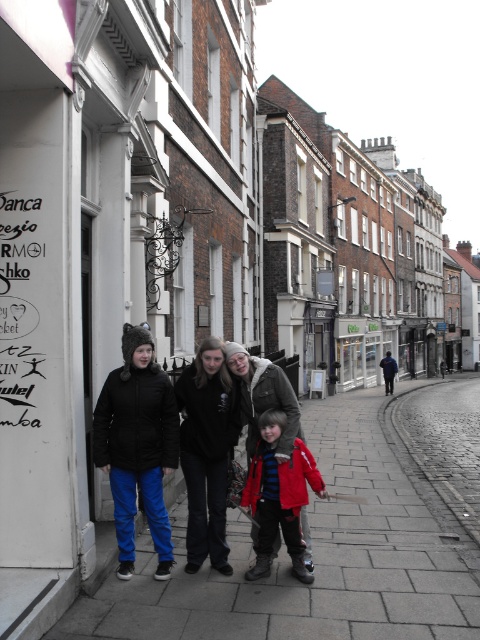
Image resolution: width=480 pixels, height=640 pixels. Find the location of `smooth concrete pavement at center`. smooth concrete pavement at center is located at coordinates (317, 557).

Identify the location of smooth concrete pavement at center. (317, 557).

Does point (124, 358) come in front of point (302, 492)?

That is False.

Which is behind, point (155, 531) or point (260, 424)?

The point (155, 531) is more distant.

Does point (123, 560) lie behind point (268, 436)?

Yes, it is.

Locate an element on the screen. matte black jackets at center is located at coordinates (163, 442).

Does point (238, 580) come in front of point (224, 508)?

Yes, it is in front of point (224, 508).

Where is `smooth concrete pavement at center`? Image resolution: width=480 pixels, height=640 pixels. smooth concrete pavement at center is located at coordinates [317, 557].

The width and height of the screenshot is (480, 640). Find the location of `smooth concrete pavement at center`. smooth concrete pavement at center is located at coordinates (317, 557).